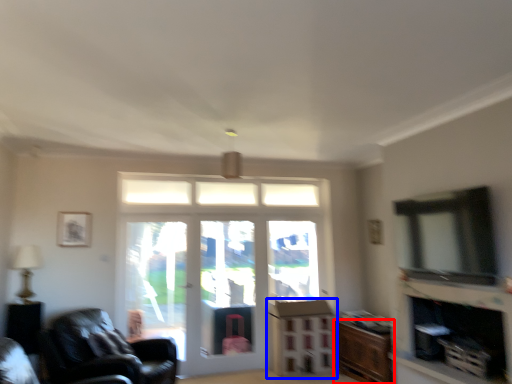
Question: Which point is further to the camera, cabinetry (highlighted by a red box) or dresser (highlighted by a blue box)?

Choices:
 (A) cabinetry
 (B) dresser

Answer: (B)